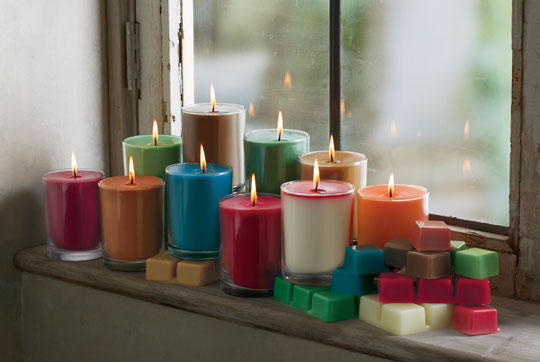
Image resolution: width=540 pixels, height=362 pixels. What are the coordinates of `candle flames` in the screenshot? It's located at (74, 162), (130, 167), (202, 158), (253, 185), (315, 172), (393, 186), (329, 143), (279, 123), (213, 98), (154, 132).